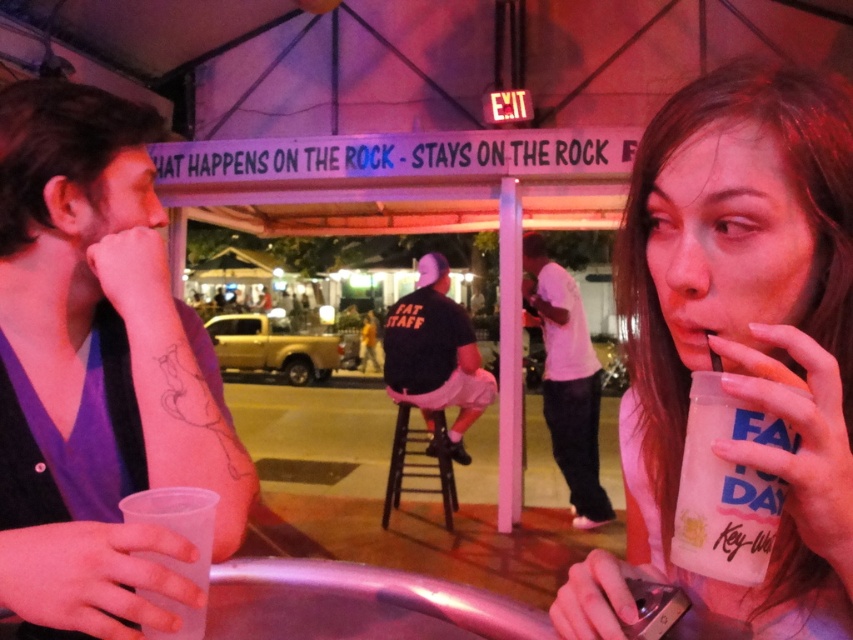
You are a bartender who needs to arrange drinks on a shelf. You have two cups available, the clear plastic cup at left and the transparent plastic cup at lower left. According to the scene, which cup should be placed higher on the shelf?

The clear plastic cup at left should be placed higher on the shelf because it is positioned above the transparent plastic cup at lower left in the scene.

Consider the image. You are a photographer standing at the camera position. You want to take a photo of the point at coordinates point (756, 577). The focus distance of your camera is set to 15 inches. Will the point be in focus?

The point at coordinates point 0.903, 0887 is 17.46 inches from the camera, which is beyond the focus distance of 15 inches. Therefore, the point will not be in focus.

You are a bartender who needs to place a new drink order. The drink you want to place is the same size as the wooden stool at center. Can the clear plastic cup at left hold this drink?

The clear plastic cup at left has a smaller size compared to the wooden stool at center. Therefore, the clear plastic cup at left cannot hold the drink since it is smaller than the wooden stool at center.